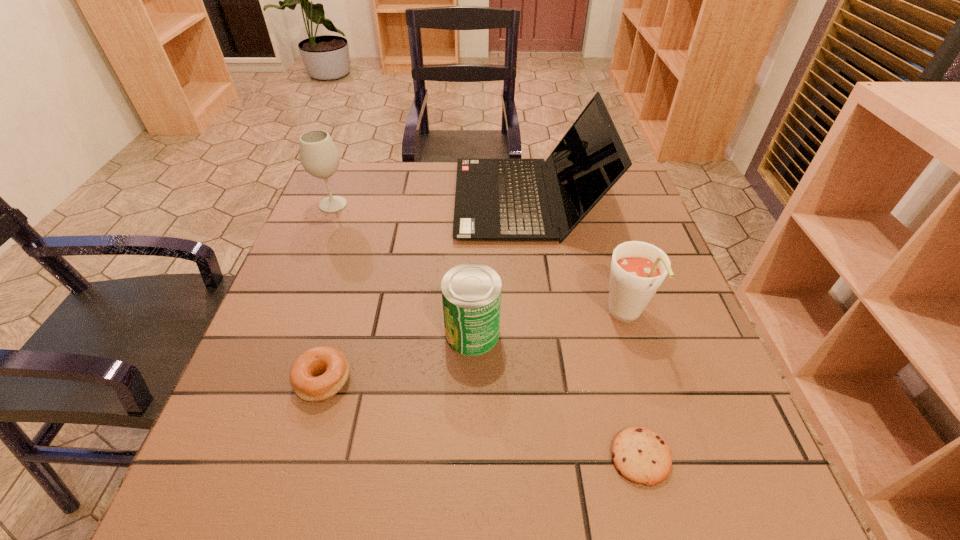
At what (x,y) coordinates should I click in order to perform the action: click on bagel located at the left edge. Please return your answer as a coordinate pair (x, y). Looking at the image, I should click on (330, 361).

Where is `laptop computer that is at the right edge`? Image resolution: width=960 pixels, height=540 pixels. laptop computer that is at the right edge is located at coordinates (495, 199).

Image resolution: width=960 pixels, height=540 pixels. I want to click on root beer that is at the right edge, so click(638, 269).

Locate an element on the screen. cookie that is at the right edge is located at coordinates (640, 455).

Locate an element on the screen. object located in the far left corner section of the desktop is located at coordinates (319, 156).

Identify the location of object that is at the far right corner. (495, 199).

You are a GUI agent. You are given a task and a screenshot of the screen. Output one action in this format:
    pyautogui.click(x=<x>, y=<y>)
    Task: Click on the object situated at the near right corner
    This screenshot has height=540, width=960.
    Given the screenshot: What is the action you would take?
    pyautogui.click(x=640, y=455)

In the image, there is a desktop. Find the location of `free space at the near edge`. free space at the near edge is located at coordinates (404, 479).

The image size is (960, 540). What are the coordinates of `vacant region at the left edge` in the screenshot? It's located at [x=271, y=422].

Identify the location of free region at the right edge of the desktop. The height and width of the screenshot is (540, 960). (588, 220).